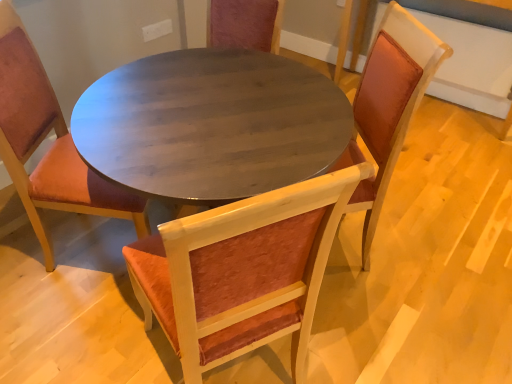
I want to click on free space in front of velvet orange chair at center, which ranks as the first chair in left-to-right order, so click(64, 326).